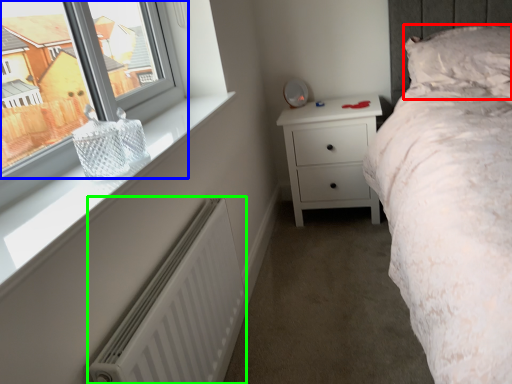
Question: Which object is the closest to the pillow (highlighted by a red box)? Choose among these: window (highlighted by a blue box) or radiator (highlighted by a green box).

Choices:
 (A) window
 (B) radiator

Answer: (B)